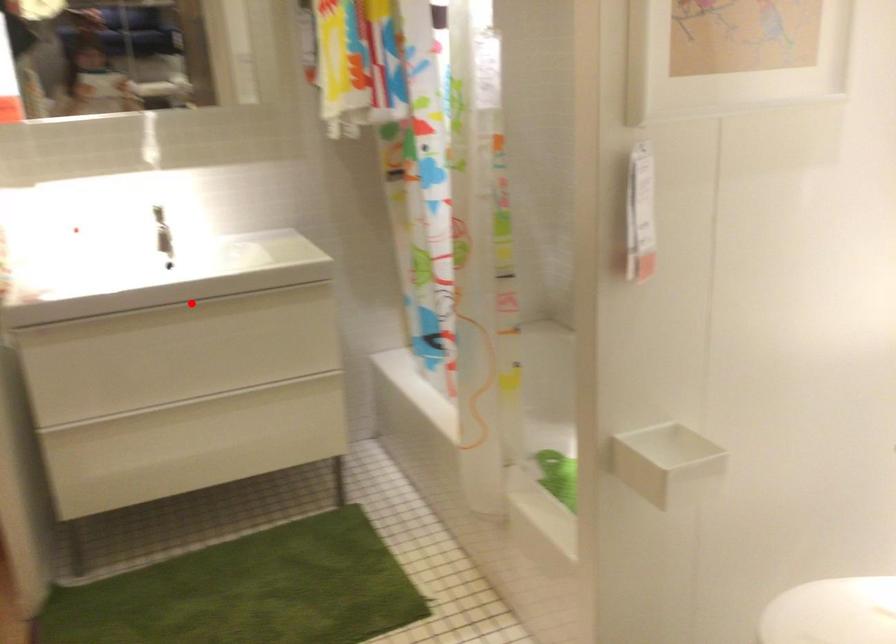
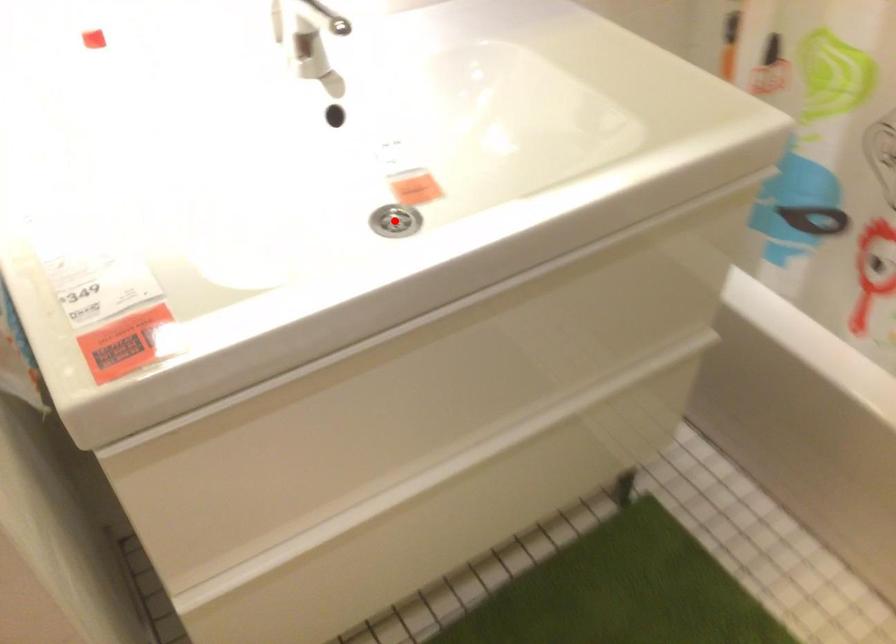
I am providing you with two images of the same scene from different viewpoints. A red point is marked on the first image and another point is marked on the second image. Is the red point in image1 aligned with the point shown in image2?

Yes